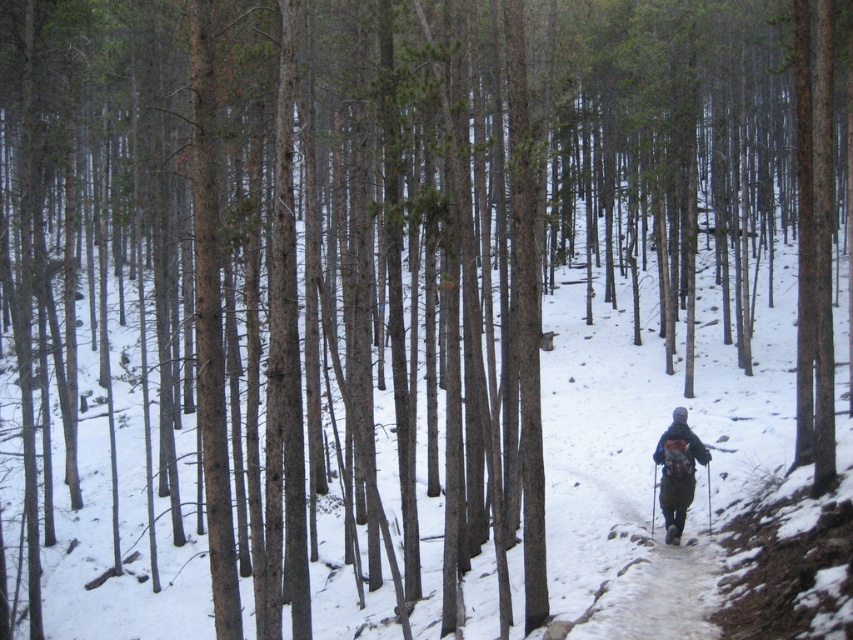
You are a hiker planning to walk along the snowy dirt path at center while carrying the dark gray backpack at center. Based on their heights, which item is more likely to be visible above the snow level?

The dark gray backpack at center is more likely to be visible above the snow level since it has a greater height than the snowy dirt path at center.

You are a hiker navigating a winter forest. You see a snowy dirt path at center and a dark gray backpack at center. Which object is closer to the bottom of the image?

The snowy dirt path at center is located below the dark gray backpack at center, so it is closer to the bottom of the image.